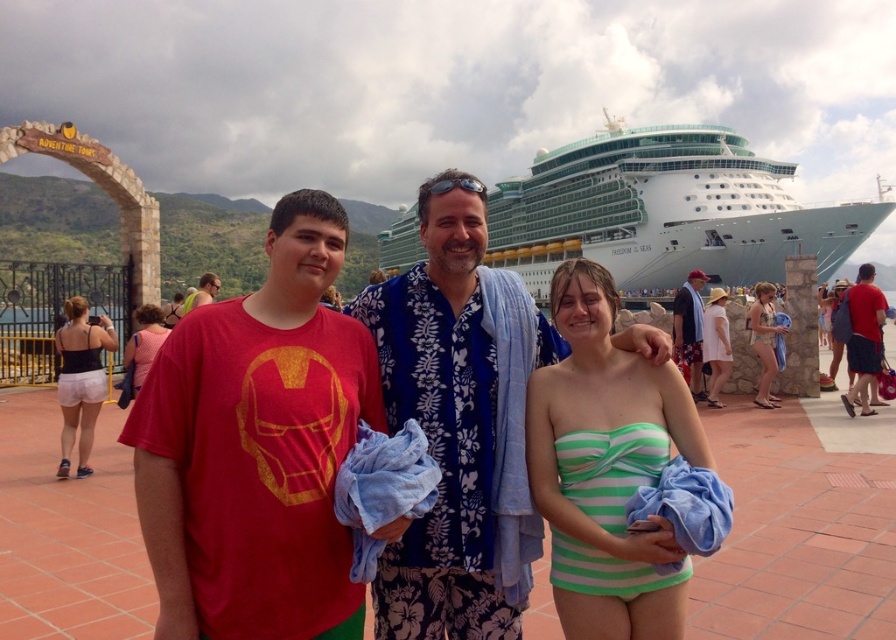
Can you confirm if blue floral shirt at right is positioned to the right of matte pink dress at center?

Correct, you'll find blue floral shirt at right to the right of matte pink dress at center.

Which is below, blue floral shirt at right or matte pink dress at center?

matte pink dress at center

Does point (676, 356) come farther from viewer compared to point (131, 394)?

Yes, point (676, 356) is behind point (131, 394).

This screenshot has height=640, width=896. I want to click on blue floral shirt at right, so click(688, 330).

Is white glossy cruise ship at upper center further to camera compared to matte pink dress at center?

Yes.

Between white glossy cruise ship at upper center and matte pink dress at center, which one has less height?

matte pink dress at center

I want to click on white glossy cruise ship at upper center, so click(x=666, y=211).

Identify the location of white glossy cruise ship at upper center. (666, 211).

Is green striped bikini at center wider than white cotton dress at right?

Yes, green striped bikini at center is wider than white cotton dress at right.

You are a GUI agent. You are given a task and a screenshot of the screen. Output one action in this format:
    pyautogui.click(x=<x>, y=<y>)
    Task: Click on the green striped bikini at center
    This screenshot has width=896, height=640.
    Given the screenshot: What is the action you would take?
    pyautogui.click(x=765, y=340)

You are a GUI agent. You are given a task and a screenshot of the screen. Output one action in this format:
    pyautogui.click(x=<x>, y=<y>)
    Task: Click on the green striped bikini at center
    The width and height of the screenshot is (896, 640).
    Given the screenshot: What is the action you would take?
    pyautogui.click(x=765, y=340)